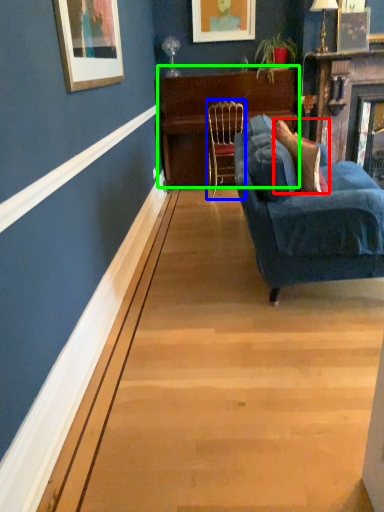
Question: Which object is the closest to the pillow (highlighted by a red box)? Choose among these: chair (highlighted by a blue box) or table (highlighted by a green box).

Choices:
 (A) chair
 (B) table

Answer: (A)